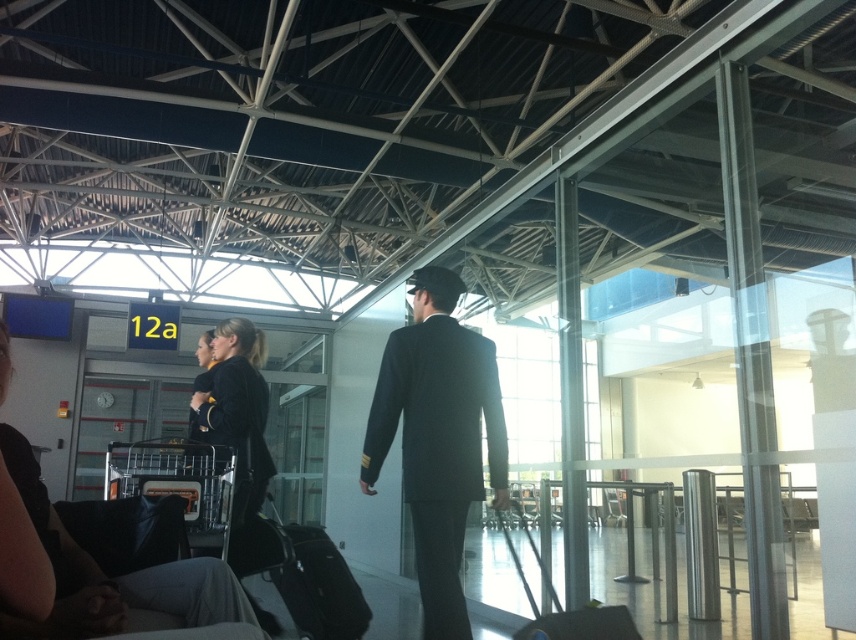
Question: Can you confirm if black leather jacket at upper left is thinner than black velvet jacket at center?

Choices:
 (A) no
 (B) yes

Answer: (A)

Question: Which object is the farthest from the matte black suitcase at center?

Choices:
 (A) dark blue suit at center
 (B) black velvet jacket at center
 (C) black leather jacket at upper left

Answer: (C)

Question: Which object appears closest to the camera in this image?

Choices:
 (A) matte black suitcase at center
 (B) black fabric suitcase at center
 (C) black velvet jacket at center

Answer: (B)

Question: Can you confirm if dark blue suit at center is positioned above black velvet jacket at center?

Choices:
 (A) yes
 (B) no

Answer: (B)

Question: Can you confirm if dark blue suit at center is thinner than matte black suitcase at center?

Choices:
 (A) no
 (B) yes

Answer: (A)

Question: Which of the following is the farthest from the observer?

Choices:
 (A) matte black suitcase at center
 (B) black velvet jacket at center
 (C) black fabric suitcase at center

Answer: (A)